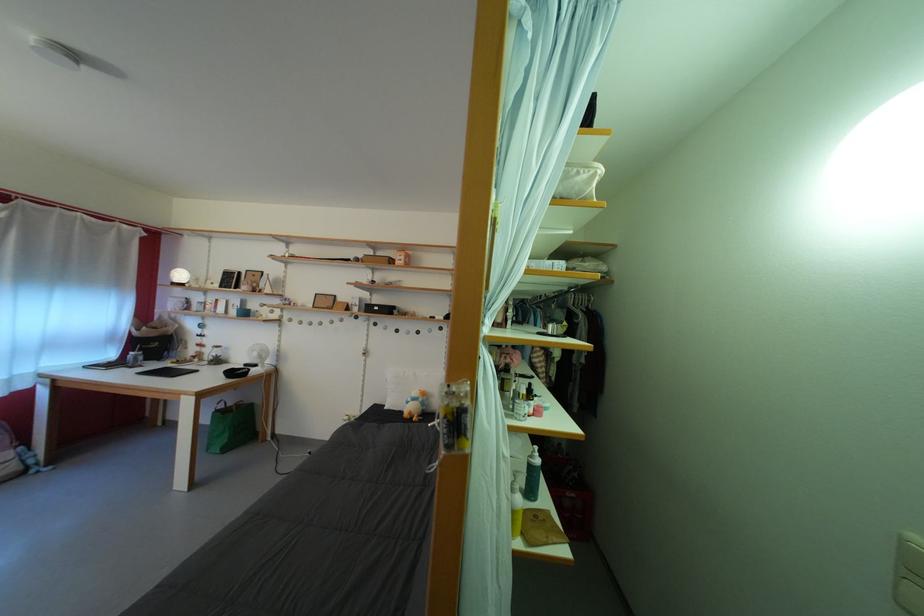
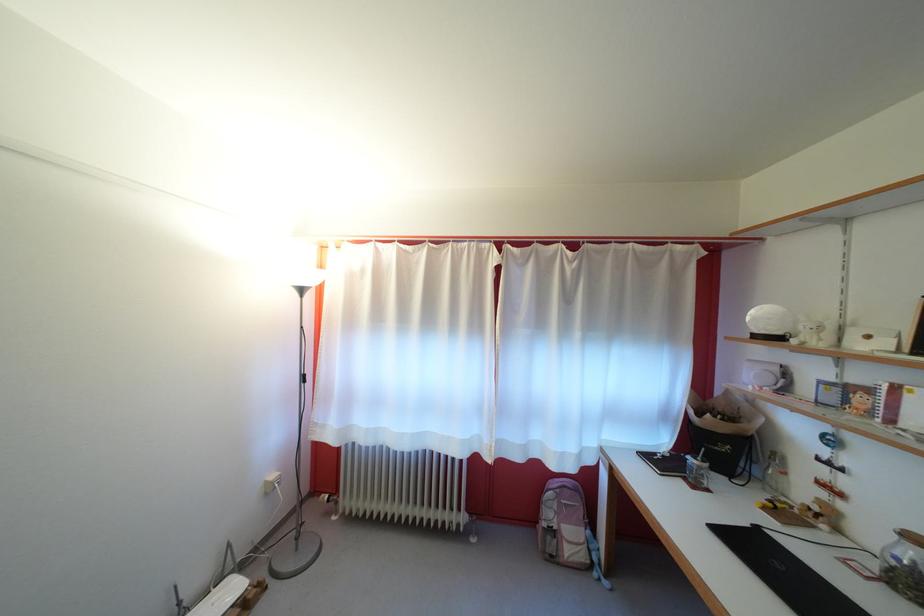
Where in the second image is the point corresponding to point (213, 310) from the first image?

(855, 395)